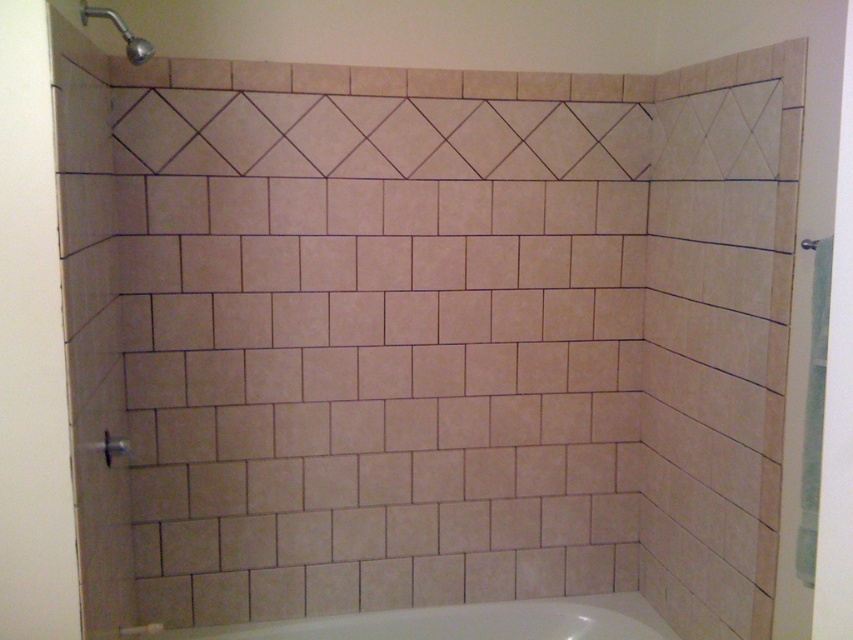
Question: Which point appears farthest from the camera in this image?

Choices:
 (A) (117, 17)
 (B) (0, 456)

Answer: (A)

Question: Does matte glass screen door at left appear over matte silver shower head at upper left?

Choices:
 (A) yes
 (B) no

Answer: (B)

Question: Which object is farther from the camera taking this photo?

Choices:
 (A) white glossy bathtub at lower center
 (B) matte glass screen door at left
 (C) matte silver shower head at upper left

Answer: (A)

Question: Does white glossy bathtub at lower center appear over matte silver shower head at upper left?

Choices:
 (A) no
 (B) yes

Answer: (A)

Question: Is matte glass screen door at left bigger than white glossy bathtub at lower center?

Choices:
 (A) no
 (B) yes

Answer: (A)

Question: Which point is farther to the camera?

Choices:
 (A) (9, 493)
 (B) (183, 630)

Answer: (B)